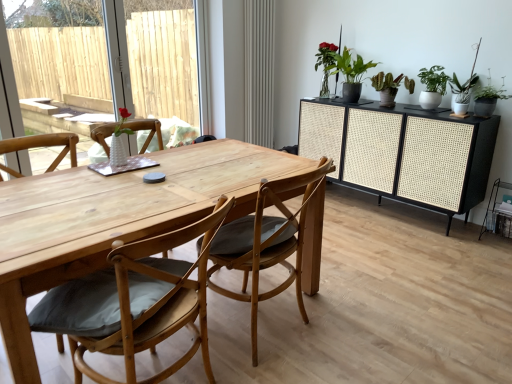
Question: Does black woven cabinet at right appear on the right side of matte gray radiator at center?

Choices:
 (A) no
 (B) yes

Answer: (B)

Question: Is black woven cabinet at right not inside matte gray radiator at center?

Choices:
 (A) no
 (B) yes

Answer: (B)

Question: Considering the relative sizes of black woven cabinet at right and matte gray radiator at center in the image provided, is black woven cabinet at right taller than matte gray radiator at center?

Choices:
 (A) no
 (B) yes

Answer: (A)

Question: Is black woven cabinet at right in contact with matte gray radiator at center?

Choices:
 (A) no
 (B) yes

Answer: (A)

Question: Is black woven cabinet at right further to camera compared to matte gray radiator at center?

Choices:
 (A) no
 (B) yes

Answer: (A)

Question: In terms of size, does green matte plant at upper right, the first houseplant viewed from the right, appear bigger or smaller than matte gray radiator at center?

Choices:
 (A) big
 (B) small

Answer: (B)

Question: Is green matte plant at upper right, which is the third houseplant from left to right, to the left or to the right of matte gray radiator at center in the image?

Choices:
 (A) right
 (B) left

Answer: (A)

Question: Relative to matte gray radiator at center, is green matte plant at upper right, the first houseplant viewed from the right, in front or behind?

Choices:
 (A) front
 (B) behind

Answer: (A)

Question: From the image's perspective, is green matte plant at upper right, which is the third houseplant from left to right, located above or below matte gray radiator at center?

Choices:
 (A) above
 (B) below

Answer: (B)

Question: In the image, is green matte plant at upper right, the first houseplant from the left, positioned in front of or behind black woven cabinet at right?

Choices:
 (A) behind
 (B) front

Answer: (A)

Question: Is green matte plant at upper right, the third houseplant from the right, inside the boundaries of black woven cabinet at right, or outside?

Choices:
 (A) inside
 (B) outside

Answer: (B)

Question: Looking at their shapes, would you say green matte plant at upper right, the third houseplant from the right, is wider or thinner than black woven cabinet at right?

Choices:
 (A) wide
 (B) thin

Answer: (B)

Question: In the image, is green matte plant at upper right, the third houseplant from the right, on the left side or the right side of black woven cabinet at right?

Choices:
 (A) left
 (B) right

Answer: (A)

Question: From a real-world perspective, relative to natural wood chair at center, arranged as the second chair when viewed from the left, is green matte plant at upper right, the first houseplant viewed from the right, vertically above or below?

Choices:
 (A) below
 (B) above

Answer: (B)

Question: Considering the relative positions of green matte plant at upper right, which is the third houseplant from left to right, and natural wood chair at center, arranged as the second chair when viewed from the left, in the image provided, is green matte plant at upper right, which is the third houseplant from left to right, to the left or to the right of natural wood chair at center, arranged as the second chair when viewed from the left,?

Choices:
 (A) left
 (B) right

Answer: (B)